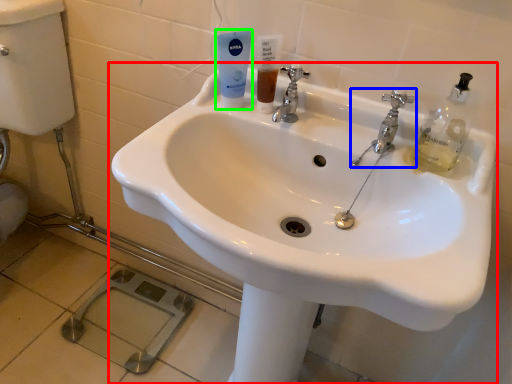
Question: Estimate the real-world distances between objects in this image. Which object is closer to sink (highlighted by a red box), tap (highlighted by a blue box) or mouthwash (highlighted by a green box)?

Choices:
 (A) tap
 (B) mouthwash

Answer: (A)